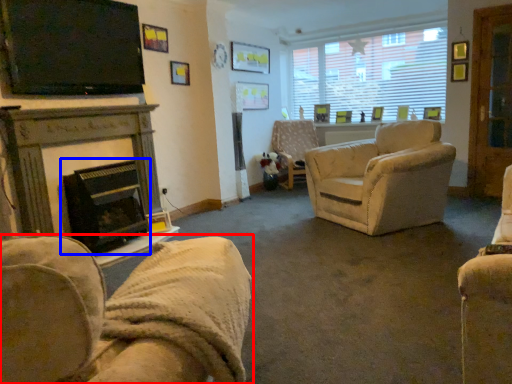
Question: Which point is further to the camera, chair (highlighted by a red box) or fireplace (highlighted by a blue box)?

Choices:
 (A) chair
 (B) fireplace

Answer: (B)